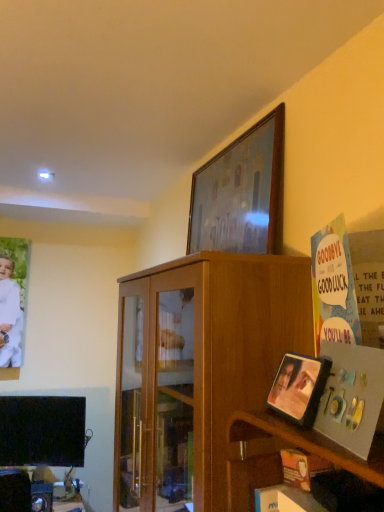
Question: Is wooden shelf at lower right outside of wooden picture frame at upper center, which appears as the 1th picture frame when viewed from the back?

Choices:
 (A) no
 (B) yes

Answer: (B)

Question: Is wooden shelf at lower right bigger than wooden picture frame at upper center, placed as the 2th picture frame when sorted from front to back?

Choices:
 (A) no
 (B) yes

Answer: (A)

Question: Does wooden shelf at lower right have a greater width compared to wooden picture frame at upper center, the 1th picture frame positioned from the top?

Choices:
 (A) no
 (B) yes

Answer: (B)

Question: Is wooden shelf at lower right taller than wooden picture frame at upper center, the 1th picture frame positioned from the top?

Choices:
 (A) no
 (B) yes

Answer: (A)

Question: Is the surface of wooden shelf at lower right in direct contact with wooden picture frame at upper center, placed as the 2th picture frame when sorted from front to back?

Choices:
 (A) yes
 (B) no

Answer: (B)

Question: Would you say wooden picture frame at upper center, placed as the 2th picture frame when sorted from front to back, is inside or outside white matte clothing at left?

Choices:
 (A) outside
 (B) inside

Answer: (A)

Question: From the image's perspective, relative to white matte clothing at left, is wooden picture frame at upper center, placed as the 2th picture frame when sorted from front to back, above or below?

Choices:
 (A) below
 (B) above

Answer: (B)

Question: In terms of height, does wooden picture frame at upper center, which appears as the 1th picture frame when viewed from the back, look taller or shorter compared to white matte clothing at left?

Choices:
 (A) tall
 (B) short

Answer: (B)

Question: Considering the positions of wooden picture frame at upper center, the 1th picture frame positioned from the top, and white matte clothing at left in the image, is wooden picture frame at upper center, the 1th picture frame positioned from the top, bigger or smaller than white matte clothing at left?

Choices:
 (A) big
 (B) small

Answer: (A)

Question: In the image, is white paper at right on the left side or the right side of wooden picture frame at upper center, which appears as the 2th picture frame when ordered from the bottom?

Choices:
 (A) left
 (B) right

Answer: (B)

Question: Is white paper at right bigger or smaller than wooden picture frame at upper center, placed as the 2th picture frame when sorted from front to back?

Choices:
 (A) big
 (B) small

Answer: (B)

Question: Relative to wooden picture frame at upper center, which appears as the 1th picture frame when viewed from the back, is white paper at right in front or behind?

Choices:
 (A) behind
 (B) front

Answer: (B)

Question: Considering the positions of white paper at right and wooden picture frame at upper center, placed as the 2th picture frame when sorted from front to back, in the image, is white paper at right taller or shorter than wooden picture frame at upper center, placed as the 2th picture frame when sorted from front to back,?

Choices:
 (A) tall
 (B) short

Answer: (B)

Question: In terms of height, does white paper at right look taller or shorter compared to wooden shelf at lower right?

Choices:
 (A) tall
 (B) short

Answer: (A)

Question: Considering the positions of white paper at right and wooden shelf at lower right in the image, is white paper at right bigger or smaller than wooden shelf at lower right?

Choices:
 (A) small
 (B) big

Answer: (A)